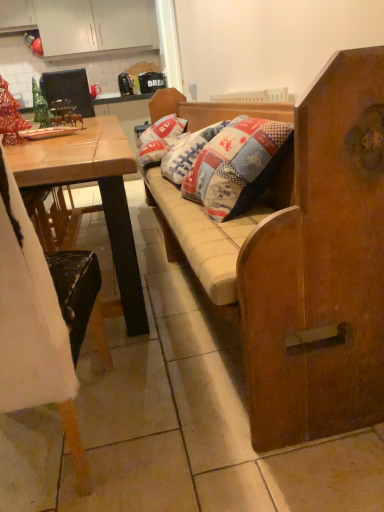
What is the approximate width of wooden cushioned bench at center?

The width of wooden cushioned bench at center is 59.94 centimeters.

What do you see at coordinates (163, 129) in the screenshot? This screenshot has width=384, height=512. I see `patchwork fabric pillow at center` at bounding box center [163, 129].

What is the approximate height of wooden desk at left?

It is 31.00 inches.

Measure the distance between wooden desk at left and camera.

They are 36.32 inches apart.

What is the approximate height of wooden chair at left?

wooden chair at left is 3.84 feet in height.

Find the location of a particular element. The image size is (384, 512). metallic black armchair at upper left is located at coordinates (68, 90).

Find the location of a particular element. This screenshot has height=512, width=384. wooden cushioned bench at center is located at coordinates (306, 264).

Is wooden cushioned bench at center looking in the opposite direction of wooden desk at left?

Absolutely, wooden cushioned bench at center is directed away from wooden desk at left.

Can you see wooden cushioned bench at center touching wooden desk at left?

wooden cushioned bench at center is not next to wooden desk at left, and they're not touching.

Is wooden desk at left a part of wooden cushioned bench at center?

No, wooden desk at left is located outside of wooden cushioned bench at center.

From a real-world perspective, does wooden cushioned bench at center stand above metallic black armchair at upper left?

No, from a real-world perspective, wooden cushioned bench at center is not on top of metallic black armchair at upper left.

Is wooden cushioned bench at center directly adjacent to metallic black armchair at upper left?

No, wooden cushioned bench at center is not in contact with metallic black armchair at upper left.

Which of these two, wooden cushioned bench at center or metallic black armchair at upper left, stands taller?

wooden cushioned bench at center is taller.

Is wooden cushioned bench at center aimed at metallic black armchair at upper left?

Yes, wooden cushioned bench at center is oriented towards metallic black armchair at upper left.

From a real-world perspective, between wooden desk at left and white matte cabinet at upper left, who is vertically higher?

From a 3D spatial view, white matte cabinet at upper left is above.

Is wooden desk at left spatially inside white matte cabinet at upper left, or outside of it?

The correct answer is: outside.

Is wooden desk at left not near white matte cabinet at upper left?

Indeed, wooden desk at left is not near white matte cabinet at upper left.

Does white matte cabinet at upper left appear on the right side of wooden desk at left?

No, white matte cabinet at upper left is not to the right of wooden desk at left.

Is white matte cabinet at upper left beside wooden desk at left?

No, white matte cabinet at upper left is not making contact with wooden desk at left.

From a real-world perspective, is white matte cabinet at upper left over wooden desk at left?

Yes, from a real-world perspective, white matte cabinet at upper left is above wooden desk at left.

How distant is white matte cabinet at upper left from wooden desk at left?

white matte cabinet at upper left is 5.22 meters away from wooden desk at left.

Is white matte cabinet at upper left in contact with wooden chair at left?

No, white matte cabinet at upper left is not making contact with wooden chair at left.

Can you confirm if white matte cabinet at upper left is smaller than wooden chair at left?

Incorrect, white matte cabinet at upper left is not smaller in size than wooden chair at left.

Does white matte cabinet at upper left come behind wooden chair at left?

Yes, white matte cabinet at upper left is behind wooden chair at left.

Measure the distance from wooden desk at left to metallic black armchair at upper left.

They are 2.06 meters apart.

Based on the photo, is metallic black armchair at upper left at the back of wooden desk at left?

wooden desk at left does not have its back to metallic black armchair at upper left.

Is the depth of wooden desk at left greater than that of metallic black armchair at upper left?

No, wooden desk at left is closer to the viewer.

Based on the photo, from a real-world perspective, which object rests below the other?

wooden desk at left.

Is metallic black armchair at upper left bigger than wooden chair at left?

No.

Considering the relative sizes of metallic black armchair at upper left and wooden chair at left in the image provided, is metallic black armchair at upper left thinner than wooden chair at left?

No.

Does metallic black armchair at upper left come behind wooden chair at left?

Yes, metallic black armchair at upper left is further from the viewer.

Where is `studio couch that is above the wooden desk at left (from the image's perspective)`? The height and width of the screenshot is (512, 384). studio couch that is above the wooden desk at left (from the image's perspective) is located at coordinates (306, 264).

I want to click on armchair on the left of wooden cushioned bench at center, so click(x=68, y=90).

Looking at the image, which one is located further to patchwork fabric pillow at center, wooden cushioned bench at center or metallic green ornament at upper left?

Among the two, wooden cushioned bench at center is located further to patchwork fabric pillow at center.

Which object lies further to the anchor point metallic green ornament at upper left, wooden cushioned bench at center or metallic black armchair at upper left?

Based on the image, wooden cushioned bench at center appears to be further to metallic green ornament at upper left.

Which object lies further to the anchor point wooden cushioned bench at center, white matte cabinet at upper left or metallic black armchair at upper left?

white matte cabinet at upper left.

Considering their positions, is white matte cabinet at upper left positioned further to metallic green ornament at upper left than wooden desk at left?

white matte cabinet at upper left lies further to metallic green ornament at upper left than the other object.

Considering their positions, is metallic black armchair at upper left positioned further to wooden desk at left than metallic green ornament at upper left?

metallic black armchair at upper left lies further to wooden desk at left than the other object.

Which object lies nearer to the anchor point wooden desk at left, patchwork fabric pillow at center or wooden chair at left?

wooden chair at left.

Which object lies further to the anchor point wooden desk at left, patchwork fabric pillow at center or metallic green ornament at upper left?

patchwork fabric pillow at center is positioned further to the anchor wooden desk at left.

From the image, which object appears to be nearer to wooden cushioned bench at center, white matte cabinet at upper left or metallic green ornament at upper left?

metallic green ornament at upper left lies closer to wooden cushioned bench at center than the other object.

This screenshot has height=512, width=384. What are the coordinates of `pillow located between wooden chair at left and metallic black armchair at upper left in the depth direction` in the screenshot? It's located at (163, 129).

This screenshot has width=384, height=512. Identify the location of christmas decoration positioned between wooden desk at left and patchwork fabric pillow at center from near to far. (40, 106).

Image resolution: width=384 pixels, height=512 pixels. I want to click on desk between wooden chair at left and metallic green ornament at upper left from front to back, so click(x=100, y=192).

Where is `desk between wooden chair at left and patchwork fabric pillow at center along the z-axis`? This screenshot has width=384, height=512. desk between wooden chair at left and patchwork fabric pillow at center along the z-axis is located at coordinates (100, 192).